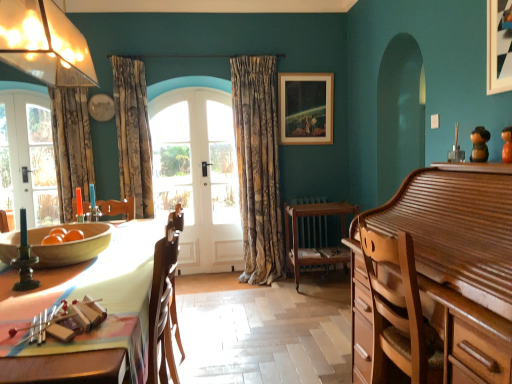
The height and width of the screenshot is (384, 512). In order to click on vacant point above wooden picture frame at upper center (from a real-world perspective) in this screenshot , I will do `click(303, 71)`.